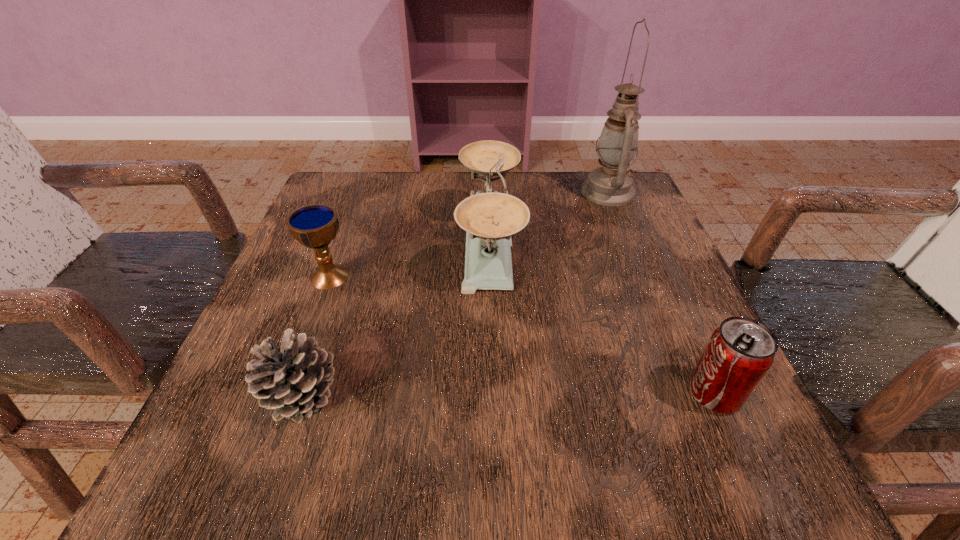
At what (x,y) coordinates should I click in order to perform the action: click on object that is at the near left corner. Please return your answer as a coordinate pair (x, y). The image size is (960, 540). Looking at the image, I should click on (294, 380).

The height and width of the screenshot is (540, 960). I want to click on object present at the far right corner, so click(611, 184).

The width and height of the screenshot is (960, 540). Find the location of `vacant space at the far edge`. vacant space at the far edge is located at coordinates (407, 173).

In the image, there is a desktop. At what (x,y) coordinates should I click in order to perform the action: click on vacant space at the left edge. Please return your answer as a coordinate pair (x, y). The width and height of the screenshot is (960, 540). Looking at the image, I should click on (299, 244).

In the image, there is a desktop. At what (x,y) coordinates should I click in order to perform the action: click on free space at the right edge. Please return your answer as a coordinate pair (x, y). Looking at the image, I should click on (645, 232).

This screenshot has width=960, height=540. I want to click on free space at the far left corner of the desktop, so click(356, 219).

Where is `free space at the near left corner`? free space at the near left corner is located at coordinates (231, 442).

Where is `vacant space that's between the pinecone and the pop soda`? Image resolution: width=960 pixels, height=540 pixels. vacant space that's between the pinecone and the pop soda is located at coordinates (509, 394).

I want to click on free space between the scale and the chalice, so click(x=409, y=261).

The height and width of the screenshot is (540, 960). I want to click on free space between the oil lamp and the scale, so click(548, 219).